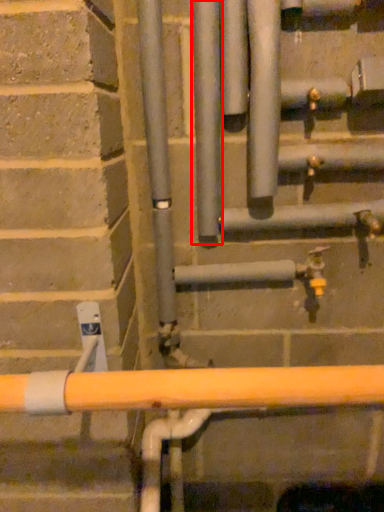
Question: From the image's perspective, where is pipe (annotated by the red box) located relative to pipe?

Choices:
 (A) above
 (B) below

Answer: (B)